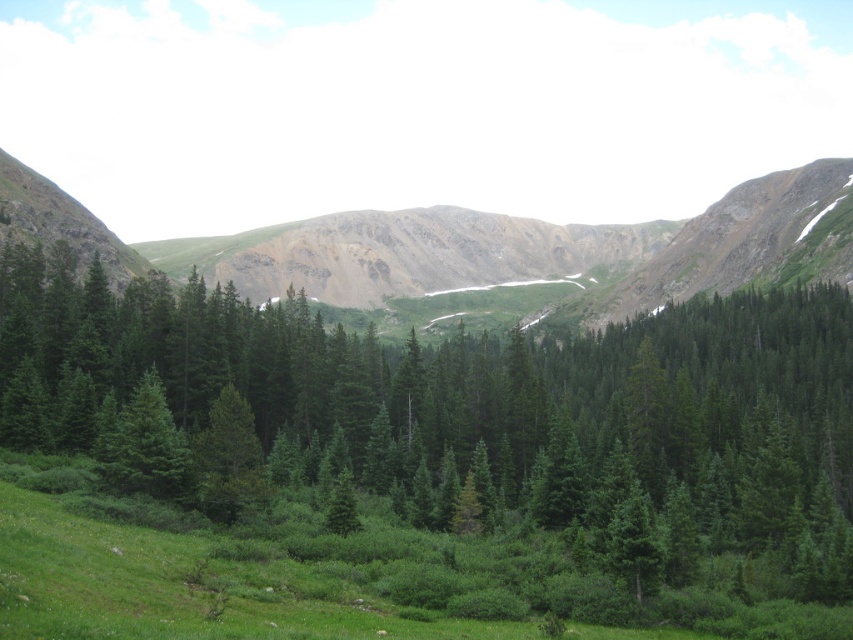
Does green grassy mountain at center have a greater width compared to green matte tree at center-left?

Correct, the width of green grassy mountain at center exceeds that of green matte tree at center-left.

Measure the distance from green grassy mountain at center to green matte tree at center-left.

green grassy mountain at center is 126.97 meters from green matte tree at center-left.

Does point (732, 275) lie behind point (161, 397)?

Yes, point (732, 275) is farther from viewer.

Where is `green grassy mountain at center`? green grassy mountain at center is located at coordinates (483, 252).

Is green matte pine forest at center further to camera compared to green matte tree at center-left?

That is False.

Between point (560, 488) and point (172, 484), which one is positioned behind?

Positioned behind is point (560, 488).

You are a GUI agent. You are given a task and a screenshot of the screen. Output one action in this format:
    pyautogui.click(x=<x>, y=<y>)
    Task: Click on the green matte pine forest at center
    The height and width of the screenshot is (640, 853).
    Given the screenshot: What is the action you would take?
    pyautogui.click(x=477, y=417)

Between point (51, 307) and point (350, 257), which one is positioned behind?

The point (350, 257) is more distant.

Is green matte pine forest at center further to camera compared to green grassy mountain at center?

No, it is in front of green grassy mountain at center.

You are a GUI agent. You are given a task and a screenshot of the screen. Output one action in this format:
    pyautogui.click(x=<x>, y=<y>)
    Task: Click on the green matte pine forest at center
    The width and height of the screenshot is (853, 640).
    Given the screenshot: What is the action you would take?
    pyautogui.click(x=477, y=417)

Locate an element on the screen. Image resolution: width=853 pixels, height=640 pixels. green matte pine forest at center is located at coordinates (477, 417).